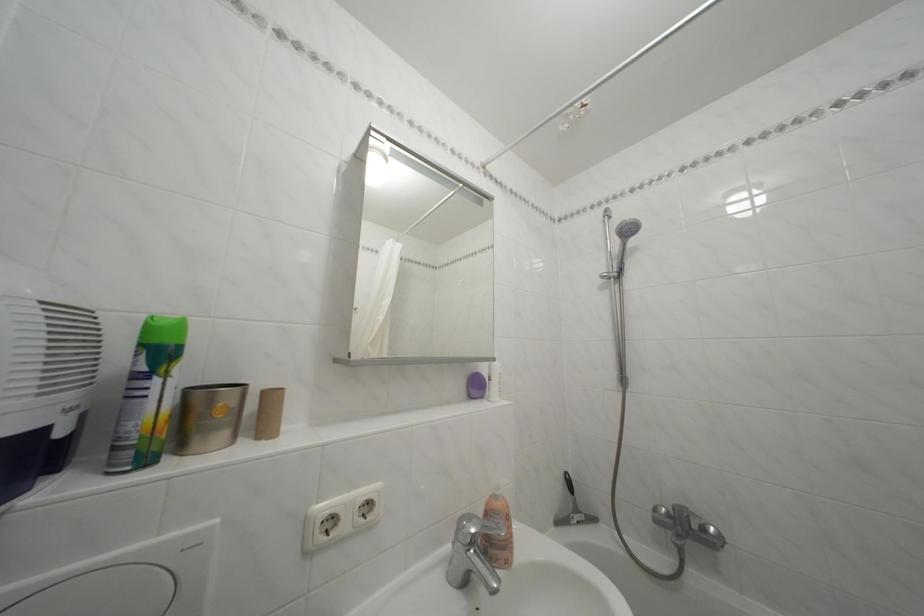
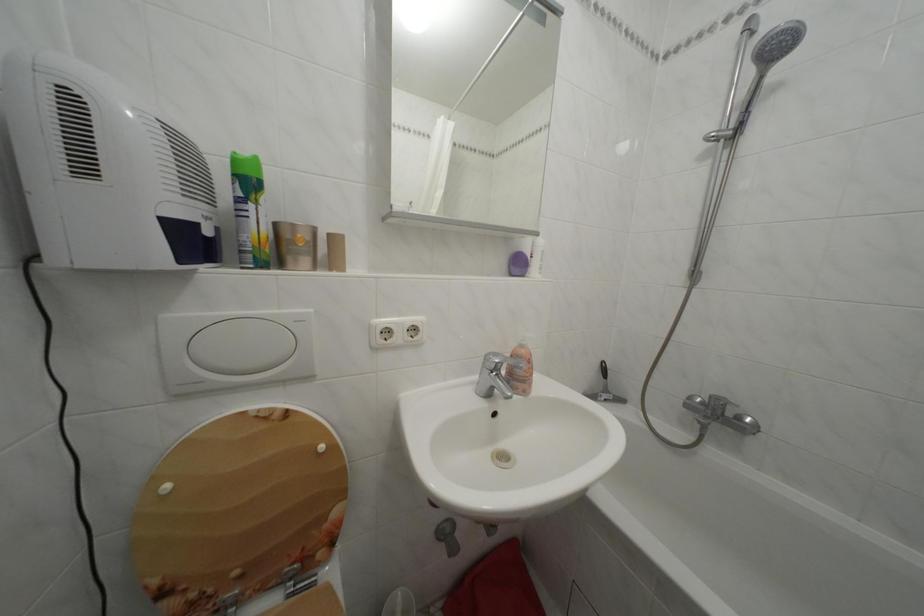
In the second image, find the point that corresponds to (x=624, y=276) in the first image.

(742, 132)